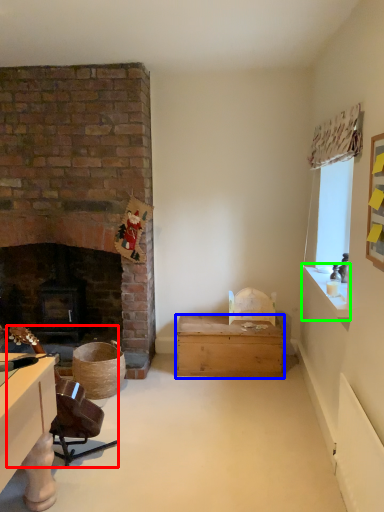
Question: Which object is positioned closest to swivel chair (highlighted by a red box)? Select from box (highlighted by a blue box) and window sill (highlighted by a green box).

Choices:
 (A) box
 (B) window sill

Answer: (A)